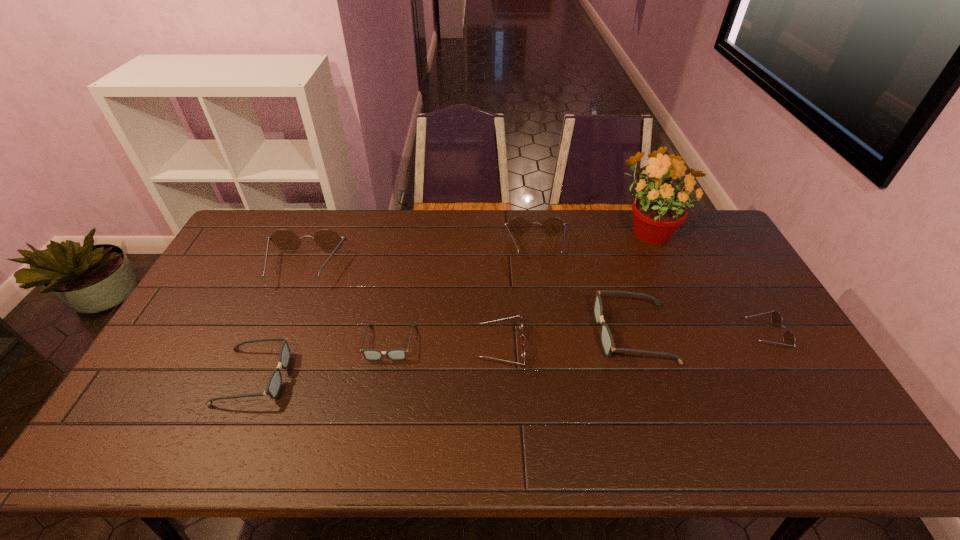
Where is `spectacles that is at the right edge`? The height and width of the screenshot is (540, 960). spectacles that is at the right edge is located at coordinates (789, 339).

At what (x,y) coordinates should I click in order to perform the action: click on object present at the far left corner. Please return your answer as a coordinate pair (x, y). This screenshot has height=540, width=960. Looking at the image, I should click on (329, 240).

The height and width of the screenshot is (540, 960). In order to click on object present at the far right corner in this screenshot , I will do `click(658, 210)`.

This screenshot has height=540, width=960. In order to click on vacant space at the far edge of the desktop in this screenshot , I will do `click(368, 232)`.

Locate an element on the screen. The height and width of the screenshot is (540, 960). free space at the near edge of the desktop is located at coordinates click(239, 452).

Identify the location of vacant space at the right edge. (774, 410).

This screenshot has height=540, width=960. I want to click on vacant position at the far right corner of the desktop, so click(x=731, y=249).

In the image, there is a desktop. Identify the location of vacant region at the near right corner. (815, 423).

Locate an element on the screen. Image resolution: width=960 pixels, height=540 pixels. empty space that is in between the leftmost yellow spectacles and the fifth spectacles from right to left is located at coordinates (347, 305).

Identify the location of vacant point located between the red flowerpot and the second smallest yellow spectacles. This screenshot has height=540, width=960. pos(574,288).